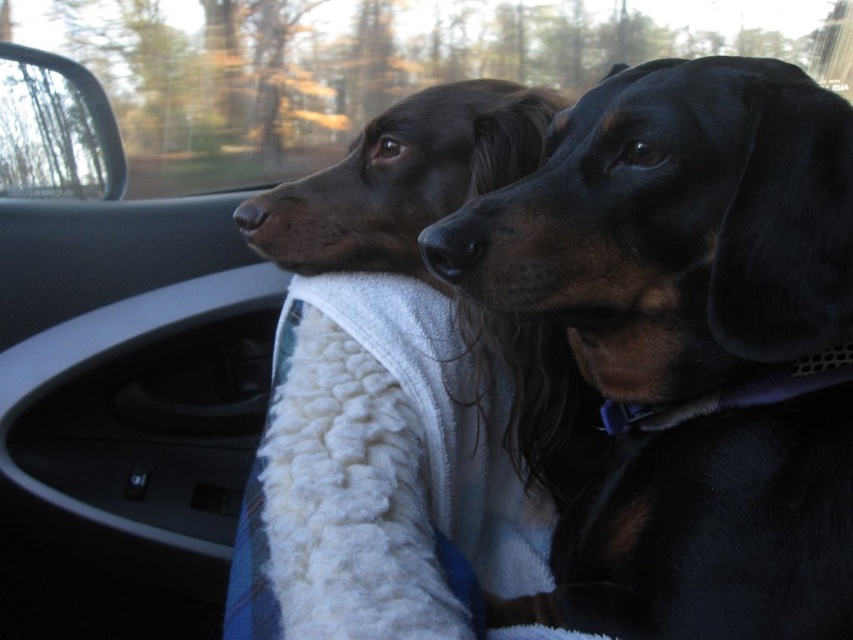
You are a passenger in the car and want to pet the shiny brown dog at center through the transparent glass car window at upper left. Is the dog within reach?

The shiny brown dog at center is closer to the viewer than the transparent glass car window at upper left, so the dog is in front of the window. Therefore, you can reach the dog without going through the window.

You are a veterinarian assessing the health of two dogs in a car. The dogs are the black smooth dog at center and the shiny brown dog at center. Based on their sizes, which one might require a larger food bowl?

The black smooth dog at center is larger in size than the shiny brown dog at center, so it would need a larger food bowl.